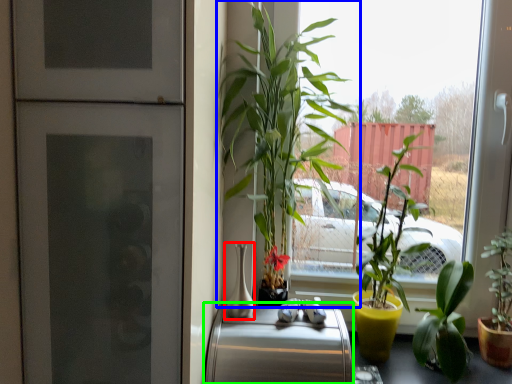
Question: Estimate the real-world distances between objects in this image. Which object is farther from vase (highlighted by a red box), houseplant (highlighted by a blue box) or appliance (highlighted by a green box)?

Choices:
 (A) houseplant
 (B) appliance

Answer: (A)